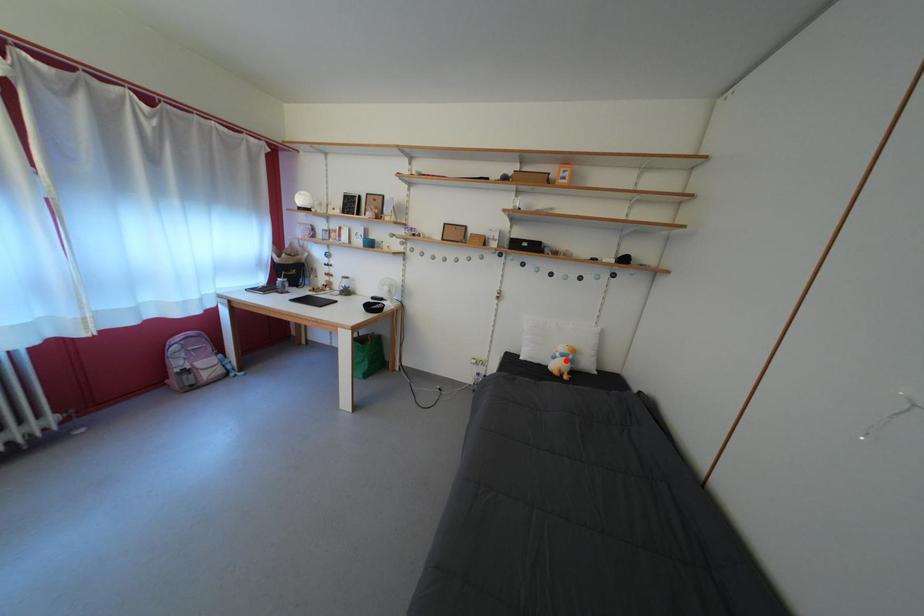
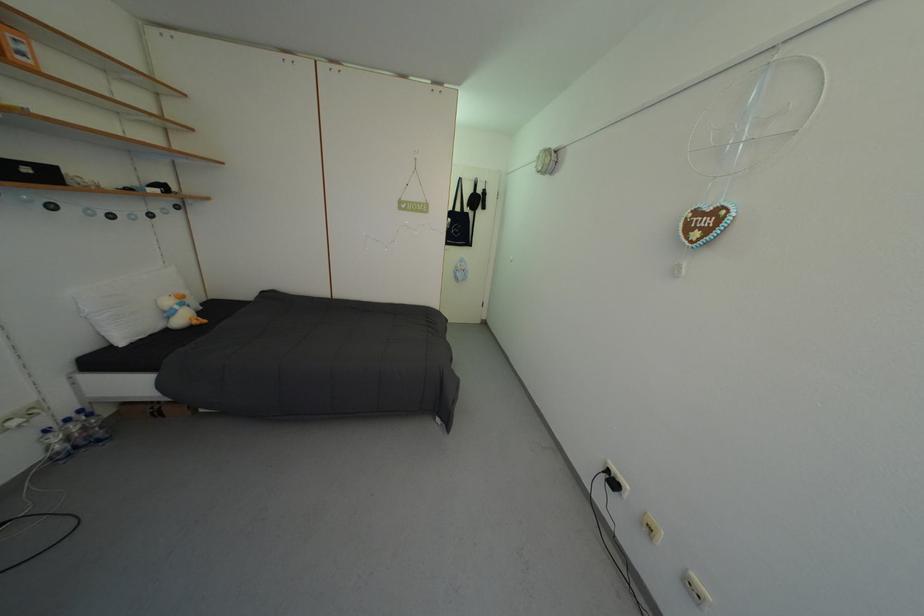
Find the pixel in the second image that matches the highlighted location in the first image.

(186, 313)